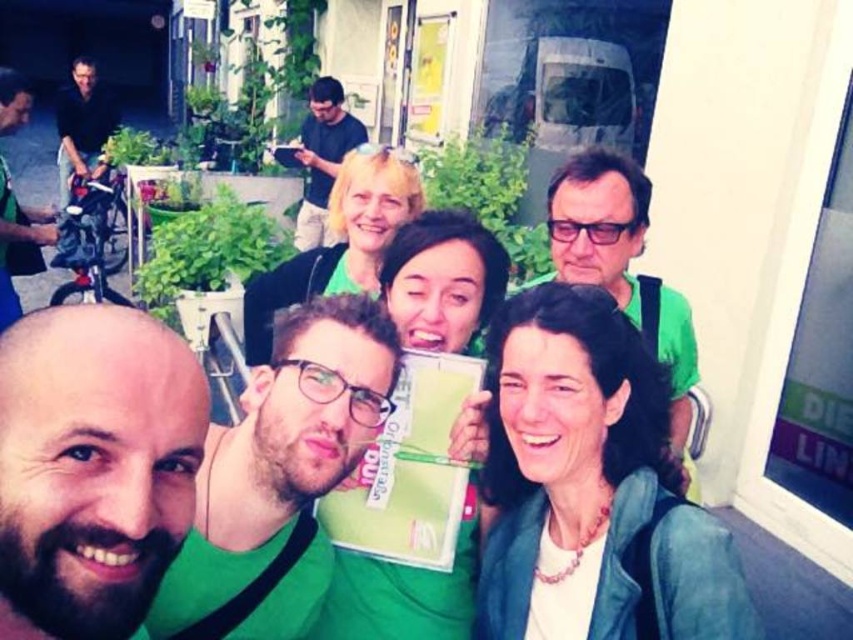
From the picture: Does green matte shirt at center have a greater height compared to black matte shirt at left?

A: Incorrect, green matte shirt at center's height is not larger of black matte shirt at left's.

Who is more forward, [225,584] or [91,113]?

Point [225,584] is in front.

Where is `green matte shirt at center`? This screenshot has width=853, height=640. green matte shirt at center is located at coordinates (280, 477).

Does bald head at center have a greater width compared to green matte shirt at upper center?

In fact, bald head at center might be narrower than green matte shirt at upper center.

Does bald head at center have a smaller size compared to green matte shirt at upper center?

Indeed, bald head at center has a smaller size compared to green matte shirt at upper center.

Which is behind, point (22, 515) or point (676, 291)?

Point (676, 291)

Find the location of a particular element. bald head at center is located at coordinates (94, 465).

How much distance is there between matte green jacket at lower right and green matte shirt at center?

15.22 inches

Which is in front, point (641, 529) or point (209, 548)?

Point (641, 529) is in front.

At what (x,y) coordinates should I click in order to perform the action: click on matte green jacket at lower right. Please return your answer as a coordinate pair (x, y). The width and height of the screenshot is (853, 640). Looking at the image, I should click on (593, 480).